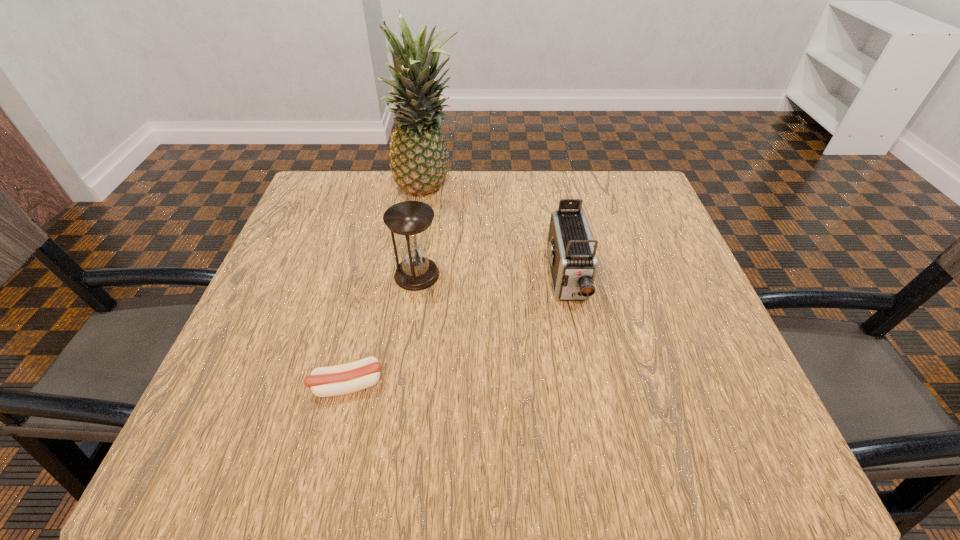
Locate an element on the screen. Image resolution: width=960 pixels, height=540 pixels. object located at the far edge is located at coordinates (418, 152).

In the image, there is a desktop. Where is `vacant space at the far edge`? vacant space at the far edge is located at coordinates (483, 206).

This screenshot has height=540, width=960. I want to click on vacant space at the near edge, so click(x=520, y=451).

Image resolution: width=960 pixels, height=540 pixels. In the image, there is a desktop. What are the coordinates of `vacant space at the left edge` in the screenshot? It's located at (261, 388).

Where is `free spot at the right edge of the desktop`? free spot at the right edge of the desktop is located at coordinates (643, 274).

The image size is (960, 540). In order to click on vacant space at the far left corner of the desktop in this screenshot , I will do `click(335, 219)`.

In the image, there is a desktop. Where is `vacant region at the near left corner`? vacant region at the near left corner is located at coordinates [185, 448].

The height and width of the screenshot is (540, 960). Identify the location of free spot at the far right corner of the desktop. (666, 222).

Image resolution: width=960 pixels, height=540 pixels. In order to click on vacant region at the near right corner in this screenshot , I will do `click(730, 466)`.

Locate an element on the screen. free space that is in between the pineapple and the nearest object is located at coordinates (388, 288).